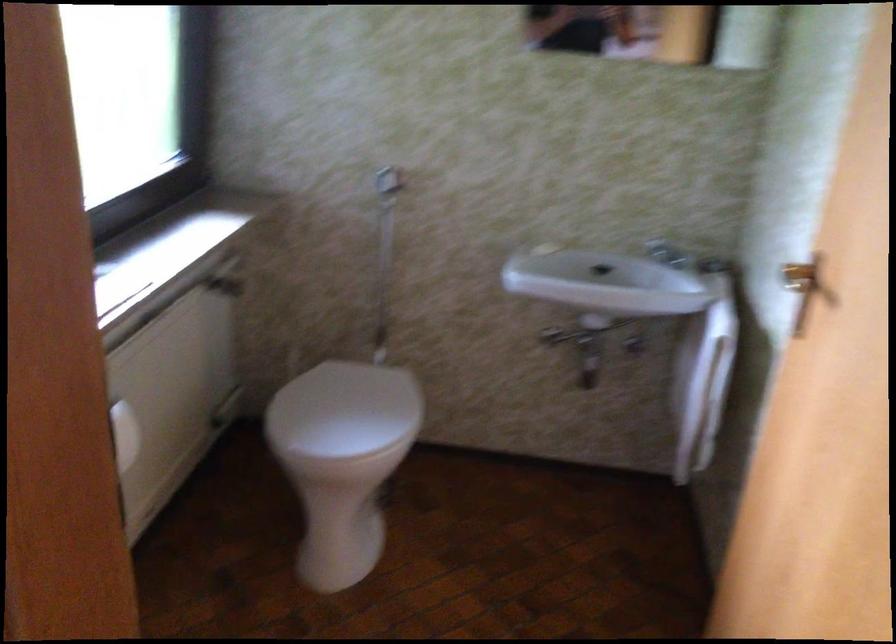
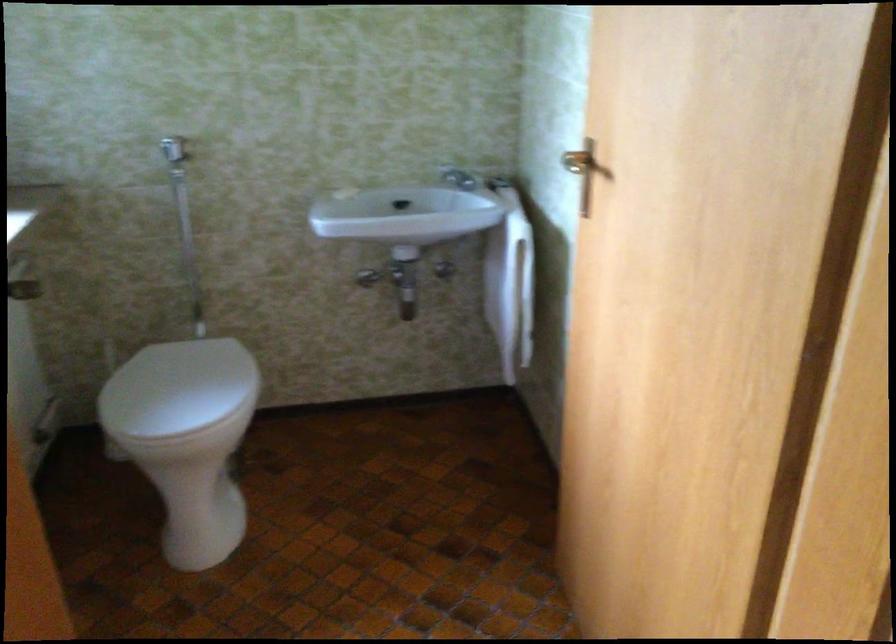
Locate, in the second image, the point that corresponds to the point at 802,266 in the first image.

(575, 162)